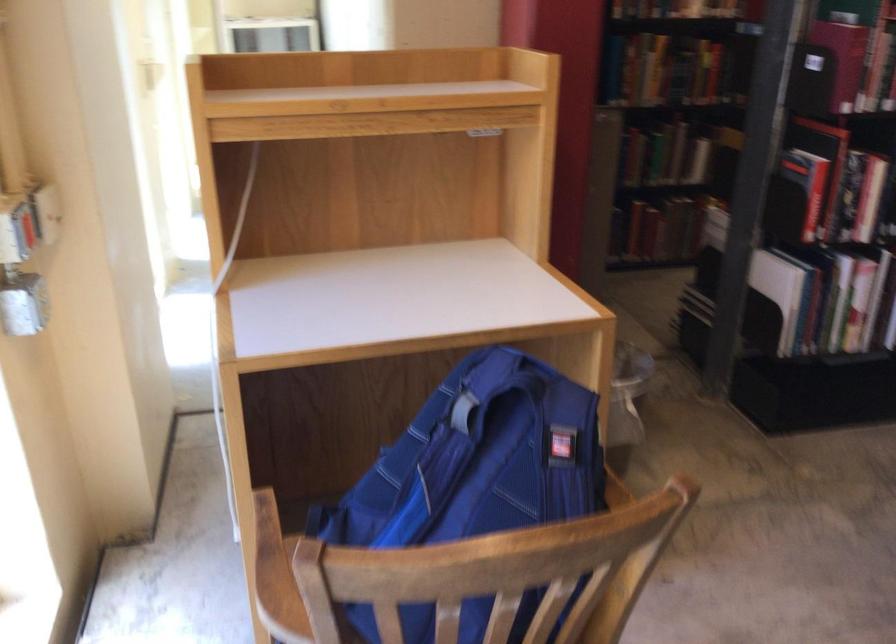
Identify the location of red electrical switch. pos(26,229).